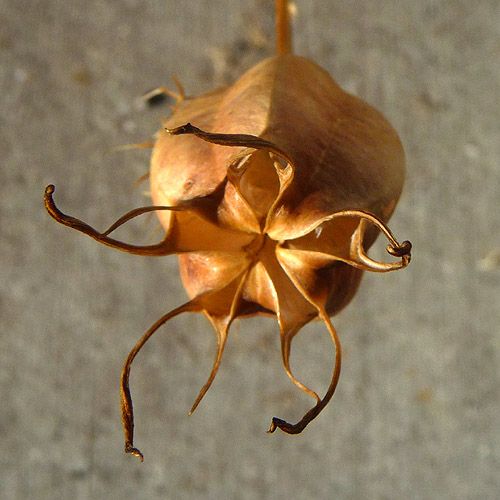
You are a GUI agent. You are given a task and a screenshot of the screen. Output one action in this format:
    pyautogui.click(x=<x>, y=<y>)
    Task: Click on the corner
    
    Given the screenshot: What is the action you would take?
    pyautogui.click(x=2, y=483)